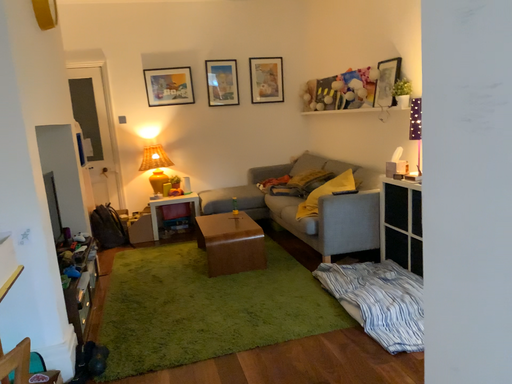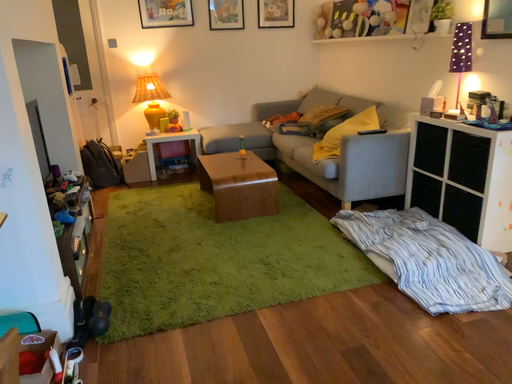
Question: Which way did the camera rotate in the video?

Choices:
 (A) rotated upward
 (B) rotated downward

Answer: (B)